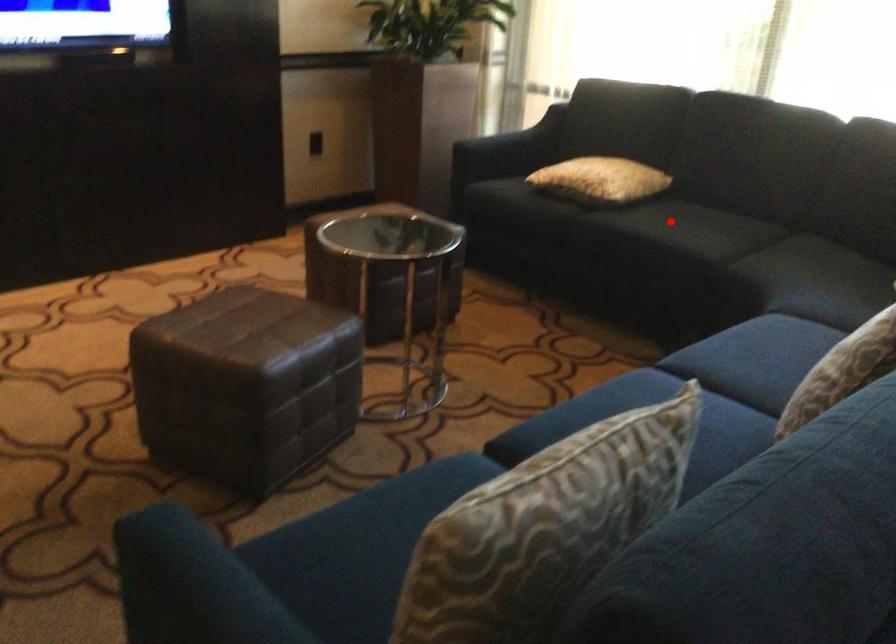
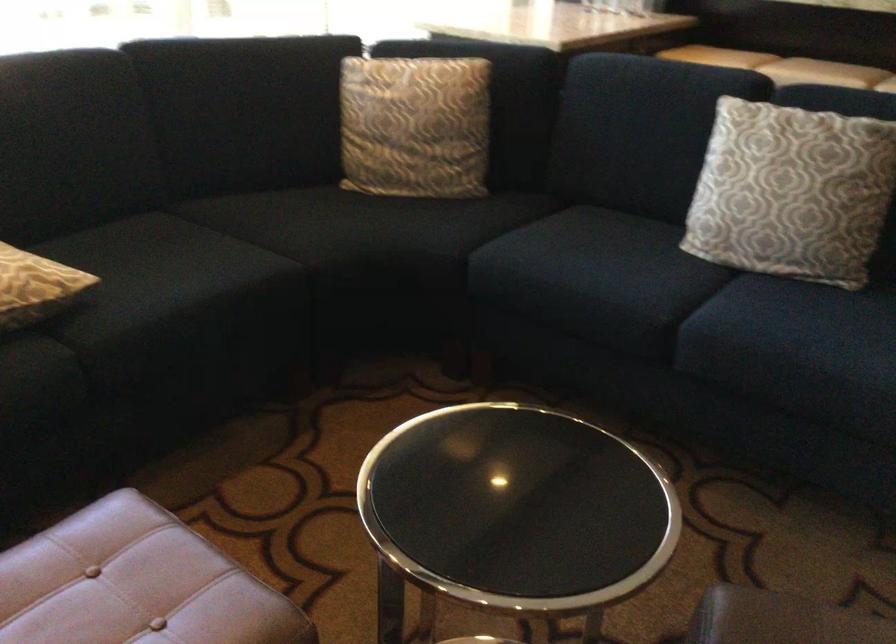
Question: I am providing you with two images of the same scene from different viewpoints. Given a red point in image1, look at the same physical point in image2. Is it:

Choices:
 (A) Closer to the viewpoint
 (B) Farther from the viewpoint

Answer: (A)